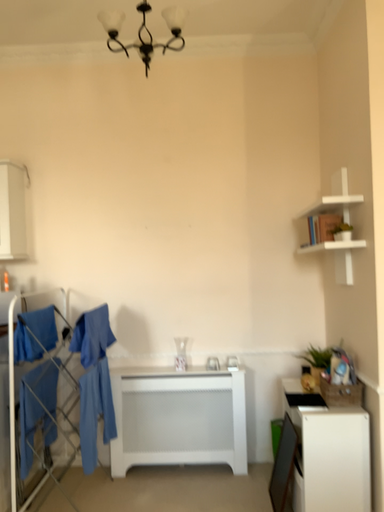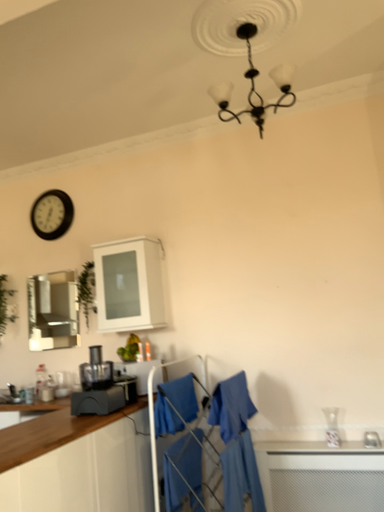
Question: How did the camera likely rotate when shooting the video?

Choices:
 (A) rotated upward
 (B) rotated downward

Answer: (A)